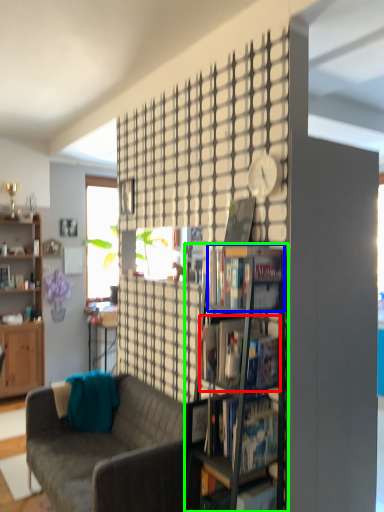
Question: Which is farther away from book (highlighted by a red box)? book (highlighted by a blue box) or shelf (highlighted by a green box)?

Choices:
 (A) book
 (B) shelf

Answer: (A)